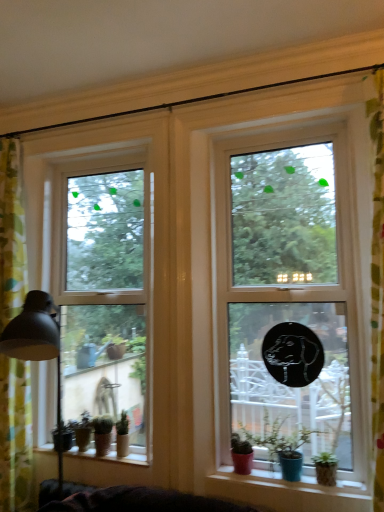
Question: Is transparent glass window at center, the 2th window viewed from the back, wider than matte black lampshade at left?

Choices:
 (A) no
 (B) yes

Answer: (A)

Question: Is transparent glass window at center, the 1th window in the front-to-back sequence, thinner than matte black lampshade at left?

Choices:
 (A) no
 (B) yes

Answer: (B)

Question: Is transparent glass window at center, the 1th window in the front-to-back sequence, to the left of matte black lampshade at left from the viewer's perspective?

Choices:
 (A) no
 (B) yes

Answer: (A)

Question: Is transparent glass window at center, which ranks as the 2th window in left-to-right order, further to the viewer compared to matte black lampshade at left?

Choices:
 (A) no
 (B) yes

Answer: (B)

Question: From a real-world perspective, is transparent glass window at center, which ranks as the 2th window in left-to-right order, below matte black lampshade at left?

Choices:
 (A) no
 (B) yes

Answer: (A)

Question: Is transparent glass window at center, which ranks as the 2th window in left-to-right order, facing away from matte black lampshade at left?

Choices:
 (A) no
 (B) yes

Answer: (A)

Question: Is transparent glass window at center, the 2th window viewed from the back, positioned behind green floral fabric curtain at left?

Choices:
 (A) no
 (B) yes

Answer: (A)

Question: Does transparent glass window at center, the 1th window in the front-to-back sequence, have a lesser height compared to green floral fabric curtain at left?

Choices:
 (A) yes
 (B) no

Answer: (A)

Question: Does transparent glass window at center, positioned as the 1th window in right-to-left order, have a larger size compared to green floral fabric curtain at left?

Choices:
 (A) yes
 (B) no

Answer: (B)

Question: Can you confirm if transparent glass window at center, the 1th window in the front-to-back sequence, is smaller than green floral fabric curtain at left?

Choices:
 (A) no
 (B) yes

Answer: (B)

Question: Is transparent glass window at center, which ranks as the 2th window in left-to-right order, oriented away from green floral fabric curtain at left?

Choices:
 (A) no
 (B) yes

Answer: (A)

Question: Would you say green floral fabric curtain at left is part of transparent glass window at center, which ranks as the 2th window in left-to-right order,'s contents?

Choices:
 (A) yes
 (B) no

Answer: (B)

Question: Is matte ceramic pots at lower center, arranged as the 2th window sill when viewed from the back, at the back of green matte plant pot at lower left, acting as the first houseplant starting from the back?

Choices:
 (A) no
 (B) yes

Answer: (A)